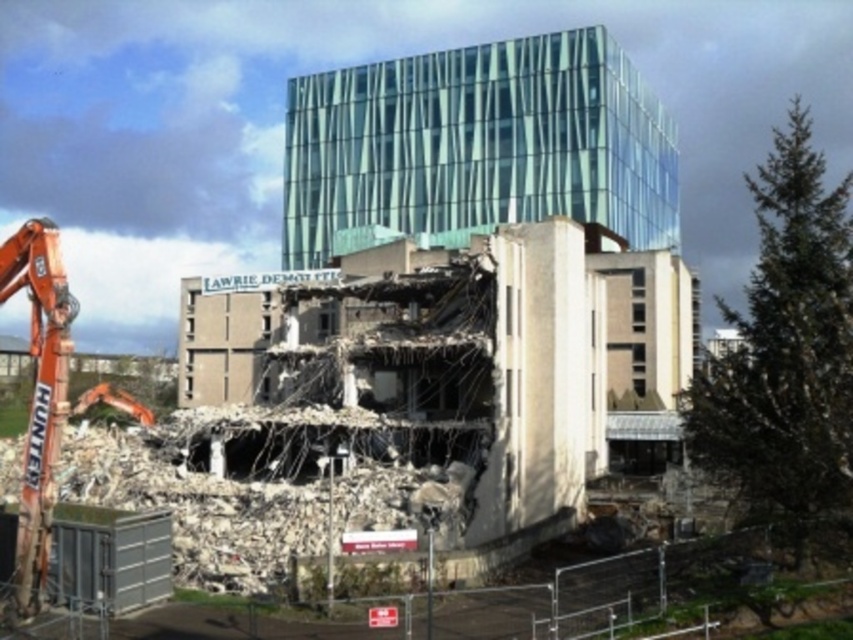
Consider the image. You are standing at the camera position and want to reach the point labeled as point (x=317, y=93). The path is clear. If you walk straight towards it, how far will you have to walk?

The point labeled point (x=317, y=93) is 164.33 meters away from the camera. So you will have to walk 164.33 meters straight to reach it.

You are a construction worker standing at the base of the partially demolished building. You need to move the rubble from the orange metallic excavator at left to the transparent glass building at upper center. Which direction should you move the rubble to ensure it reaches the correct location?

The transparent glass building at upper center is closer to you than the orange metallic excavator at left. To move the rubble towards the glass building, you should move it forward since it is in front of the excavator.